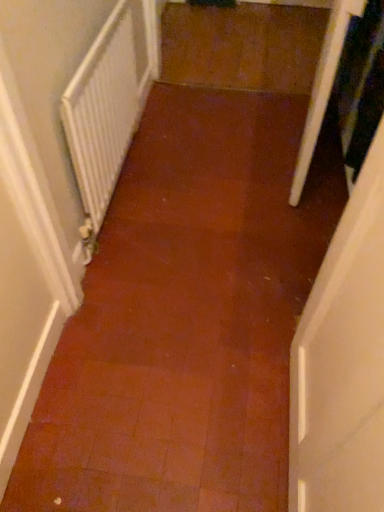
Question: Does transparent plastic screen door at right come behind white textured radiator at left?

Choices:
 (A) no
 (B) yes

Answer: (B)

Question: Is transparent plastic screen door at right next to white textured radiator at left?

Choices:
 (A) no
 (B) yes

Answer: (A)

Question: Is transparent plastic screen door at right smaller than white textured radiator at left?

Choices:
 (A) yes
 (B) no

Answer: (B)

Question: Is transparent plastic screen door at right not within white textured radiator at left?

Choices:
 (A) yes
 (B) no

Answer: (A)

Question: Is transparent plastic screen door at right far away from white textured radiator at left?

Choices:
 (A) yes
 (B) no

Answer: (B)

Question: Does transparent plastic screen door at right have a larger size compared to white textured radiator at left?

Choices:
 (A) yes
 (B) no

Answer: (A)

Question: From the image's perspective, is white textured radiator at left above transparent plastic screen door at right?

Choices:
 (A) no
 (B) yes

Answer: (A)

Question: Does white textured radiator at left contain transparent plastic screen door at right?

Choices:
 (A) yes
 (B) no

Answer: (B)

Question: From a real-world perspective, is white textured radiator at left physically below transparent plastic screen door at right?

Choices:
 (A) no
 (B) yes

Answer: (B)

Question: Is white textured radiator at left aimed at transparent plastic screen door at right?

Choices:
 (A) yes
 (B) no

Answer: (A)

Question: Is white textured radiator at left facing away from transparent plastic screen door at right?

Choices:
 (A) yes
 (B) no

Answer: (B)

Question: Is white textured radiator at left at the right side of transparent plastic screen door at right?

Choices:
 (A) no
 (B) yes

Answer: (A)

Question: Relative to transparent plastic screen door at right, is white textured radiator at left in front or behind?

Choices:
 (A) behind
 (B) front

Answer: (B)